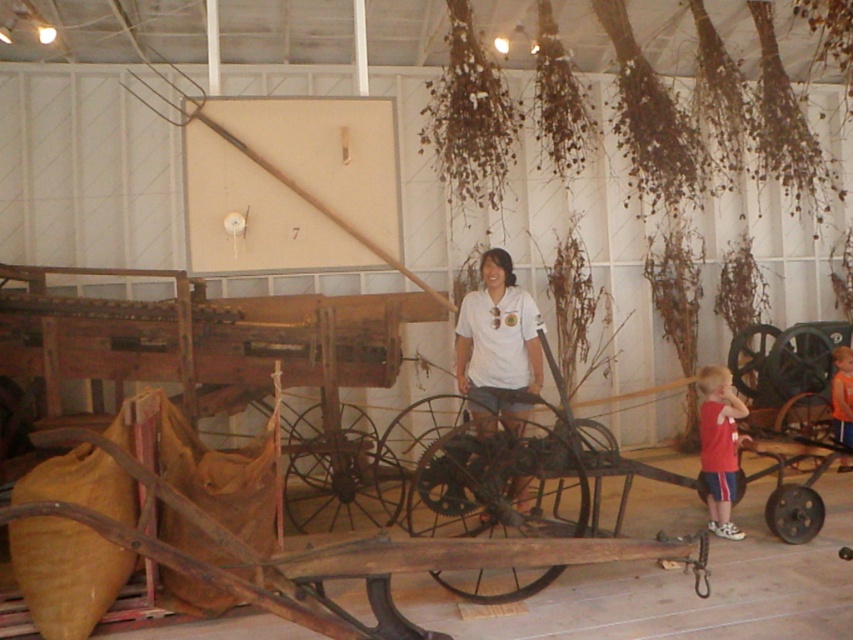
Does white matte shirt at center have a greater height compared to red cotton shirt at lower right?

Yes, white matte shirt at center is taller than red cotton shirt at lower right.

This screenshot has height=640, width=853. Describe the element at coordinates (497, 342) in the screenshot. I see `white matte shirt at center` at that location.

This screenshot has width=853, height=640. I want to click on white matte shirt at center, so click(x=497, y=342).

Based on the photo, who is taller, white matte shirt at center or orange t-shirt at lower right?

white matte shirt at center

Which of these two, white matte shirt at center or orange t-shirt at lower right, stands shorter?

orange t-shirt at lower right is shorter.

Is point (523, 413) positioned behind point (833, 380)?

No.

Where is `white matte shirt at center`? white matte shirt at center is located at coordinates (497, 342).

Between red cotton shirt at lower right and orange t-shirt at lower right, which one appears on the left side from the viewer's perspective?

red cotton shirt at lower right is more to the left.

Between red cotton shirt at lower right and orange t-shirt at lower right, which one has less height?

With less height is orange t-shirt at lower right.

Does point (708, 481) lie behind point (833, 376)?

That is False.

The image size is (853, 640). Identify the location of red cotton shirt at lower right. (718, 445).